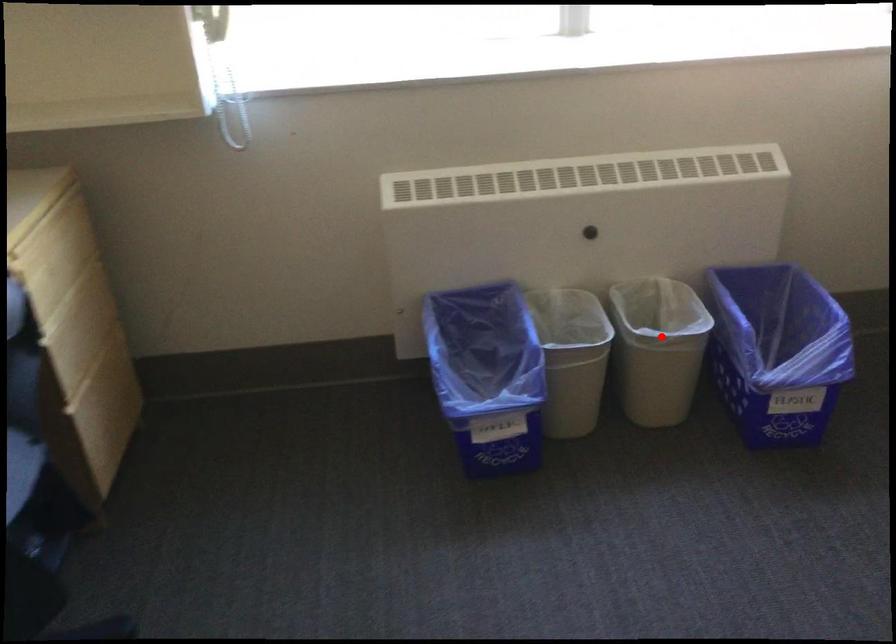
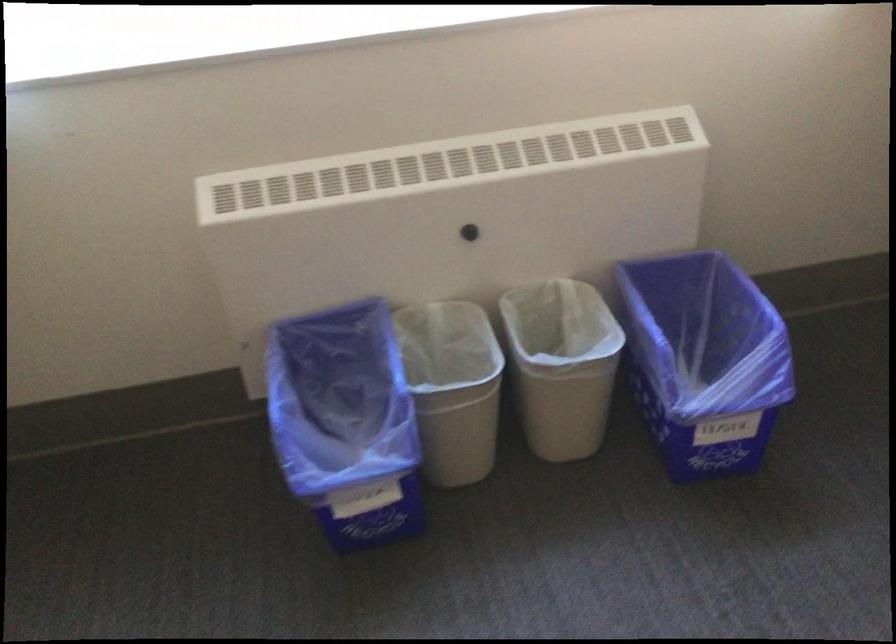
Question: A red point is marked in image1. In image2, is the corresponding 3D point closer to the camera or farther? Reply with the corresponding letter.

Choices:
 (A) The corresponding 3D point is closer.
 (B) The corresponding 3D point is farther.

Answer: (A)